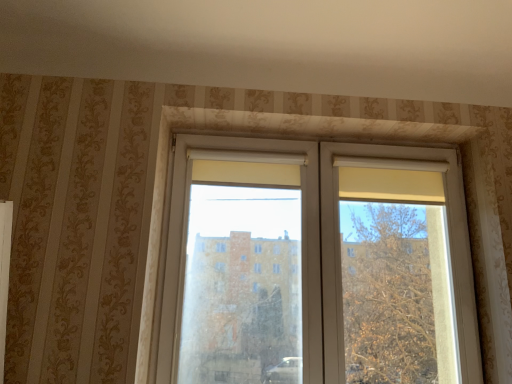
Question: From the image's perspective, is white plastic window at center located above or below white plastic screen door at center?

Choices:
 (A) above
 (B) below

Answer: (A)

Question: From a real-world perspective, is white plastic window at center above or below white plastic screen door at center?

Choices:
 (A) below
 (B) above

Answer: (B)

Question: Considering their positions, is white plastic window at center located in front of or behind white plastic screen door at center?

Choices:
 (A) front
 (B) behind

Answer: (B)

Question: Visually, is white plastic screen door at center positioned to the left or to the right of white plastic window at center?

Choices:
 (A) right
 (B) left

Answer: (B)

Question: Considering the positions of point (228, 342) and point (349, 254), is point (228, 342) closer or farther from the camera than point (349, 254)?

Choices:
 (A) farther
 (B) closer

Answer: (B)

Question: From their relative heights in the image, would you say white plastic screen door at center is taller or shorter than white plastic window at center?

Choices:
 (A) tall
 (B) short

Answer: (B)

Question: Looking at the image, does white plastic screen door at center seem bigger or smaller compared to white plastic window at center?

Choices:
 (A) big
 (B) small

Answer: (A)